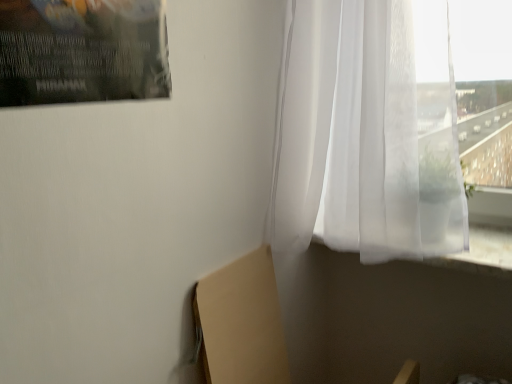
Question: Is translucent white curtain at upper right in front of or behind beige cardboard at lower left in the image?

Choices:
 (A) front
 (B) behind

Answer: (A)

Question: Is translucent white curtain at upper right inside or outside of beige cardboard at lower left?

Choices:
 (A) inside
 (B) outside

Answer: (B)

Question: Considering the positions of point (303, 243) and point (226, 365), is point (303, 243) closer or farther from the camera than point (226, 365)?

Choices:
 (A) farther
 (B) closer

Answer: (A)

Question: Is point 217,291 positioned closer to the camera than point 280,109?

Choices:
 (A) farther
 (B) closer

Answer: (B)

Question: In the image, is beige cardboard at lower left on the left side or the right side of translucent white curtain at upper right?

Choices:
 (A) right
 (B) left

Answer: (B)

Question: Do you think beige cardboard at lower left is within translucent white curtain at upper right, or outside of it?

Choices:
 (A) inside
 (B) outside

Answer: (B)

Question: From the image's perspective, is beige cardboard at lower left above or below translucent white curtain at upper right?

Choices:
 (A) above
 (B) below

Answer: (B)